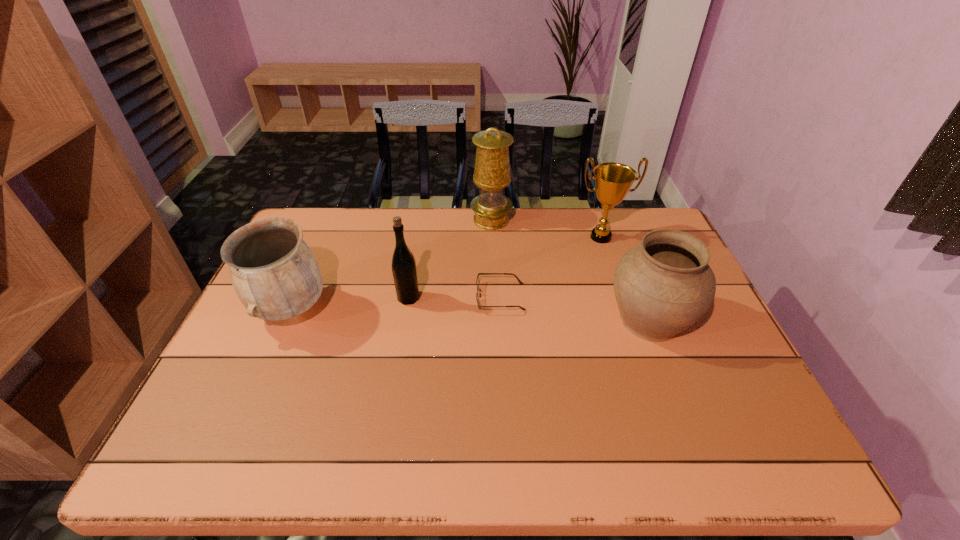
You are a GUI agent. You are given a task and a screenshot of the screen. Output one action in this format:
    pyautogui.click(x=<x>, y=<y>)
    Task: Click on the vacant area between the oil lamp and the right urn
    The image size is (960, 540).
    Given the screenshot: What is the action you would take?
    570,270

Locate an element on the screen. free area in between the right urn and the leftmost object is located at coordinates point(470,314).

Locate which object ranks in proximity to the leftmost object. Please provide its 2D coordinates. Your answer should be formatted as a tuple, i.e. [(x, y)], where the tuple contains the x and y coordinates of a point satisfying the conditions above.

[(404, 271)]

Identify which object is located as the second nearest to the beer bottle. Please provide its 2D coordinates. Your answer should be formatted as a tuple, i.e. [(x, y)], where the tuple contains the x and y coordinates of a point satisfying the conditions above.

[(274, 273)]

This screenshot has height=540, width=960. What are the coordinates of `free space that satisfies the following two spatial constraints: 1. on the front side of the oil lamp; 2. on the right side of the right urn` in the screenshot? It's located at (494, 320).

Where is `vacant space that satisfies the following two spatial constraints: 1. on the back side of the beer bottle; 2. on the left side of the oil lamp`? The image size is (960, 540). vacant space that satisfies the following two spatial constraints: 1. on the back side of the beer bottle; 2. on the left side of the oil lamp is located at coordinates (421, 220).